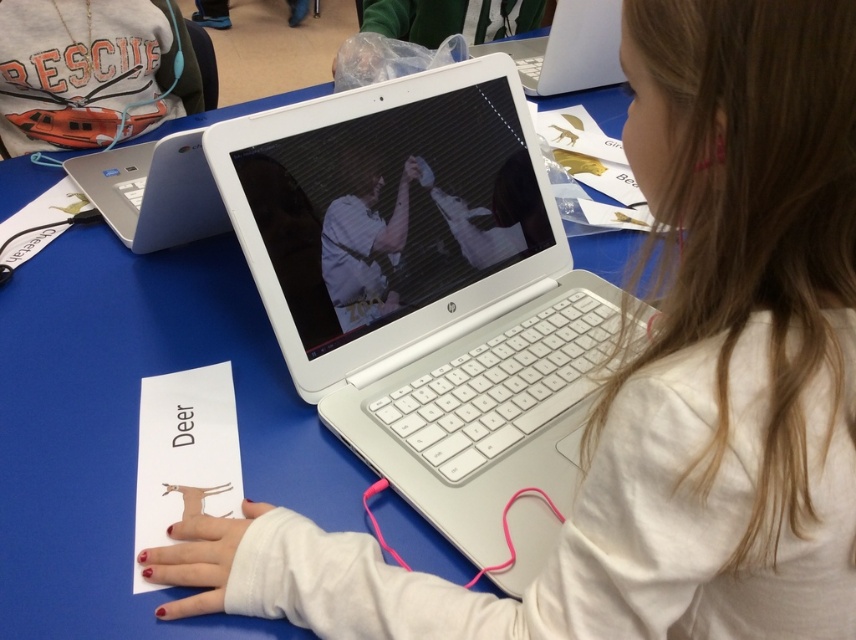
You are an interior designer planning to place a new decorative item on a shelf. You have the matte orange lifeboat at upper left and the white plastic laptop at upper center. Based on their sizes, which one would you choose if you need an item that takes up more space horizontally?

The white plastic laptop at upper center should be chosen because it has a greater width than the matte orange lifeboat at upper left, meaning it occupies more horizontal space.

In the scene shown: You are trying to place a small sticker exactly at point (383,417) on the table. If your hand is currently 50 centimeters away from the table surface, how much closer do you need to move your hand to reach the point?

The distance of point (383,417) from viewer is 64.83 centimeters. Since your hand is currently 50 centimeters away, you need to move it 14.83 centimeters closer to reach the point.

You are trying to place both the white plastic laptop at center and the white plastic laptop at upper center on a shelf. According to the description, which one is wider?

The white plastic laptop at center is wider than the white plastic laptop at upper center according to the description.